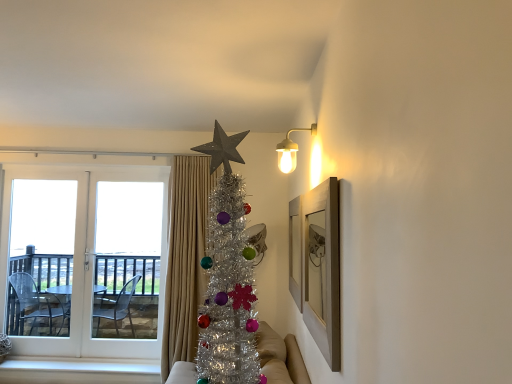
Question: Is white glass door at left, which is the first screen door from right to left, not close to metallic fabric couch at center?

Choices:
 (A) yes
 (B) no

Answer: (A)

Question: From the image's perspective, is white glass door at left, which ranks as the second screen door in left-to-right order, on metallic fabric couch at center?

Choices:
 (A) no
 (B) yes

Answer: (B)

Question: Is white glass door at left, which ranks as the second screen door in left-to-right order, positioned before metallic fabric couch at center?

Choices:
 (A) yes
 (B) no

Answer: (B)

Question: Can you confirm if white glass door at left, which is the first screen door from right to left, is bigger than metallic fabric couch at center?

Choices:
 (A) yes
 (B) no

Answer: (B)

Question: Considering the relative sizes of white glass door at left, which is the first screen door from right to left, and metallic fabric couch at center in the image provided, is white glass door at left, which is the first screen door from right to left, wider than metallic fabric couch at center?

Choices:
 (A) yes
 (B) no

Answer: (B)

Question: Does white glass door at left, which is the first screen door from right to left, turn towards metallic fabric couch at center?

Choices:
 (A) no
 (B) yes

Answer: (A)

Question: Considering the relative sizes of white wood at lower left and wooden picture frame at upper right in the image provided, is white wood at lower left shorter than wooden picture frame at upper right?

Choices:
 (A) no
 (B) yes

Answer: (B)

Question: From the image's perspective, is white wood at lower left beneath wooden picture frame at upper right?

Choices:
 (A) no
 (B) yes

Answer: (B)

Question: From the image's perspective, is white wood at lower left above wooden picture frame at upper right?

Choices:
 (A) no
 (B) yes

Answer: (A)

Question: Could you tell me if white wood at lower left is facing wooden picture frame at upper right?

Choices:
 (A) yes
 (B) no

Answer: (B)

Question: Is white wood at lower left at the right side of wooden picture frame at upper right?

Choices:
 (A) no
 (B) yes

Answer: (A)

Question: Considering the relative positions of white wood at lower left and wooden picture frame at upper right in the image provided, is white wood at lower left behind wooden picture frame at upper right?

Choices:
 (A) no
 (B) yes

Answer: (B)

Question: Is wooden picture frame at upper right looking in the opposite direction of white glass door at left?

Choices:
 (A) no
 (B) yes

Answer: (A)